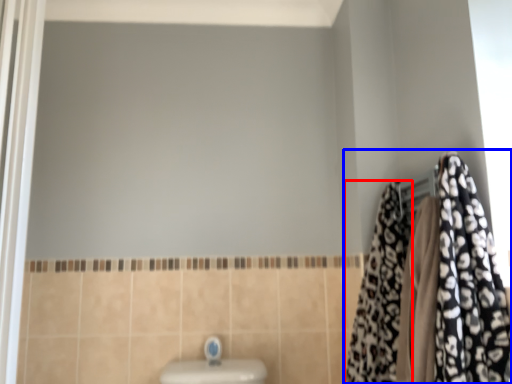
Question: Which object is closer to the camera taking this photo, cloth (highlighted by a red box) or closet (highlighted by a blue box)?

Choices:
 (A) cloth
 (B) closet

Answer: (B)